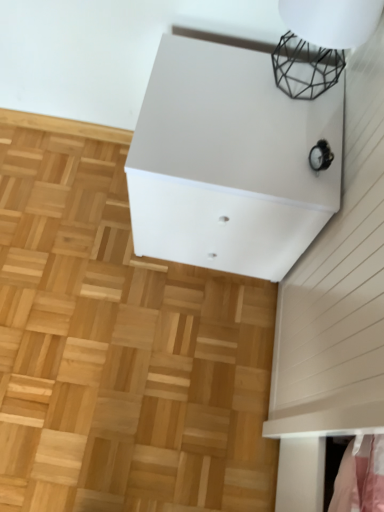
Locate an element on the screen. This screenshot has height=512, width=384. white matte cabinet at upper center is located at coordinates (229, 162).

You are a GUI agent. You are given a task and a screenshot of the screen. Output one action in this format:
    pyautogui.click(x=<x>, y=<y>)
    Task: Click on the white matte cabinet at upper center
    The height and width of the screenshot is (512, 384).
    Given the screenshot: What is the action you would take?
    pyautogui.click(x=229, y=162)

Image resolution: width=384 pixels, height=512 pixels. Identify the location of furniture lying above the natural wood parquet floor at center (from the image's perspective). (229, 162).

From the picture: In terms of height, does natural wood parquet floor at center look taller or shorter compared to white matte cabinet at upper center?

natural wood parquet floor at center is shorter than white matte cabinet at upper center.

From the picture: Is natural wood parquet floor at center wider or thinner than white matte cabinet at upper center?

Considering their sizes, natural wood parquet floor at center looks broader than white matte cabinet at upper center.

Relative to natural wood parquet floor at center, is black wire mesh at upper right in front or behind?

In the image, black wire mesh at upper right appears in front of natural wood parquet floor at center.

From a real-world perspective, is black wire mesh at upper right physically above natural wood parquet floor at center?

Indeed, from a real-world perspective, black wire mesh at upper right stands above natural wood parquet floor at center.

From the image's perspective, relative to natural wood parquet floor at center, is black wire mesh at upper right above or below?

From the image's perspective, black wire mesh at upper right appears above natural wood parquet floor at center.

Are natural wood parquet floor at center and black wire mesh at upper right far apart?

No, natural wood parquet floor at center is not far away from black wire mesh at upper right.

Measure the distance between natural wood parquet floor at center and black wire mesh at upper right.

A distance of 30.37 inches exists between natural wood parquet floor at center and black wire mesh at upper right.

Which object is positioned more to the left, natural wood parquet floor at center or black wire mesh at upper right?

From the viewer's perspective, natural wood parquet floor at center appears more on the left side.

Is natural wood parquet floor at center positioned behind black wire mesh at upper right?

Yes, the depth of natural wood parquet floor at center is greater than that of black wire mesh at upper right.

Is black wire mesh at upper right looking in the opposite direction of white matte cabinet at upper center?

black wire mesh at upper right does not have its back to white matte cabinet at upper center.

At what (x,y) coordinates should I click in order to perform the action: click on furniture on the left of the black wire mesh at upper right. Please return your answer as a coordinate pair (x, y). This screenshot has width=384, height=512. Looking at the image, I should click on tap(229, 162).

Considering the sizes of black wire mesh at upper right and white matte cabinet at upper center in the image, is black wire mesh at upper right taller or shorter than white matte cabinet at upper center?

Considering their sizes, black wire mesh at upper right has less height than white matte cabinet at upper center.

Between white matte cabinet at upper center and natural wood parquet floor at center, which one appears on the right side from the viewer's perspective?

white matte cabinet at upper center is more to the right.

From a real-world perspective, which is physically below, white matte cabinet at upper center or natural wood parquet floor at center?

natural wood parquet floor at center is physically lower.

The height and width of the screenshot is (512, 384). I want to click on furniture above the natural wood parquet floor at center (from the image's perspective), so click(x=229, y=162).

Can you tell me how much white matte cabinet at upper center and natural wood parquet floor at center differ in facing direction?

The angle between the facing direction of white matte cabinet at upper center and the facing direction of natural wood parquet floor at center is 89.6 degrees.

How distant is white matte cabinet at upper center from black wire mesh at upper right?

white matte cabinet at upper center is 8.04 inches from black wire mesh at upper right.

Does white matte cabinet at upper center have a greater height compared to black wire mesh at upper right?

Indeed, white matte cabinet at upper center has a greater height compared to black wire mesh at upper right.

Is white matte cabinet at upper center facing away from black wire mesh at upper right?

That's not correct — white matte cabinet at upper center is not looking away from black wire mesh at upper right.

In the image, there is a white matte cabinet at upper center. Find the location of `hardwood below it (from the image's perspective)`. hardwood below it (from the image's perspective) is located at coordinates tap(119, 345).

Where is `lamp on the right of natural wood parquet floor at center`? The width and height of the screenshot is (384, 512). lamp on the right of natural wood parquet floor at center is located at coordinates (319, 42).

Based on their spatial positions, is natural wood parquet floor at center or white matte cabinet at upper center further from black wire mesh at upper right?

natural wood parquet floor at center is positioned further to the anchor black wire mesh at upper right.

When comparing their distances from white matte cabinet at upper center, does black wire mesh at upper right or natural wood parquet floor at center seem closer?

Based on the image, black wire mesh at upper right appears to be nearer to white matte cabinet at upper center.

Estimate the real-world distances between objects in this image. Which object is further from black wire mesh at upper right, white matte cabinet at upper center or natural wood parquet floor at center?

Based on the image, natural wood parquet floor at center appears to be further to black wire mesh at upper right.

Considering their positions, is natural wood parquet floor at center positioned further to white matte cabinet at upper center than black wire mesh at upper right?

natural wood parquet floor at center.

Estimate the real-world distances between objects in this image. Which object is closer to natural wood parquet floor at center, white matte cabinet at upper center or black wire mesh at upper right?

white matte cabinet at upper center is positioned closer to the anchor natural wood parquet floor at center.

Estimate the real-world distances between objects in this image. Which object is further from natural wood parquet floor at center, black wire mesh at upper right or white matte cabinet at upper center?

The object further to natural wood parquet floor at center is black wire mesh at upper right.

Locate an element on the screen. Image resolution: width=384 pixels, height=512 pixels. furniture between black wire mesh at upper right and natural wood parquet floor at center in the vertical direction is located at coordinates (229, 162).